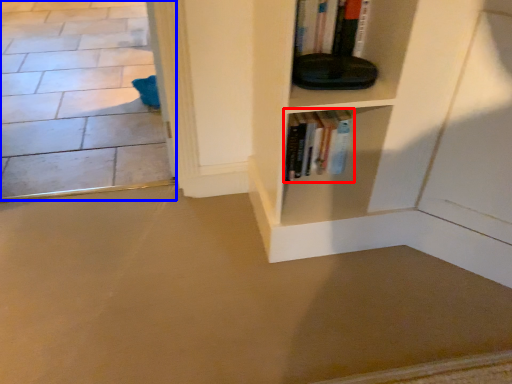
Question: Which point is further to the camera, book (highlighted by a red box) or concrete (highlighted by a blue box)?

Choices:
 (A) book
 (B) concrete

Answer: (B)